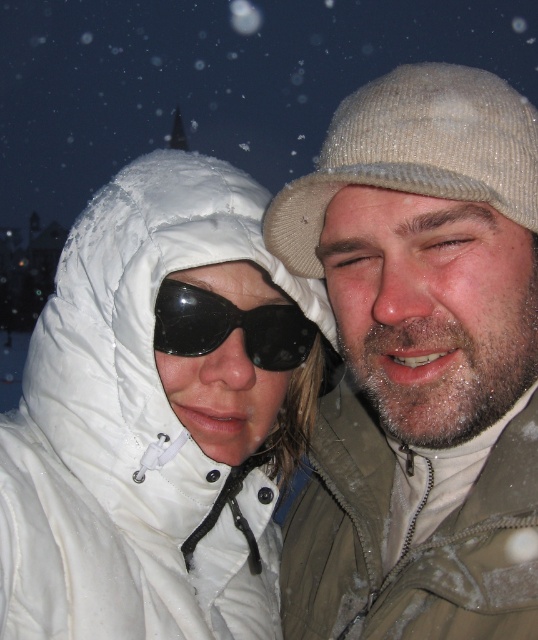
You are standing in the snowy night scene and want to take a photo of the fuzzy beige knit cap at upper right. If your camera has a maximum focus range of 10 feet, will you be able to capture it clearly?

The fuzzy beige knit cap at upper right is 10.84 feet from the camera, which exceeds the maximum focus range of 10 feet. Therefore, it may not be captured clearly.